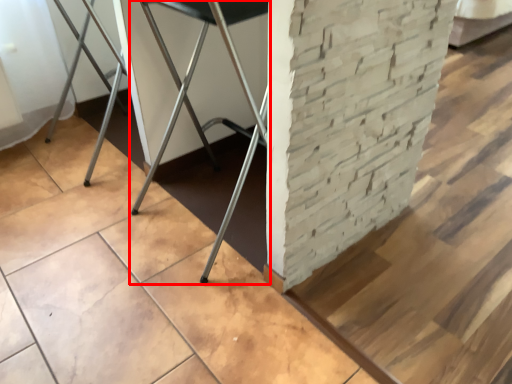
Question: Where is furniture (annotated by the red box) located in relation to concrete in the image?

Choices:
 (A) left
 (B) right

Answer: (A)